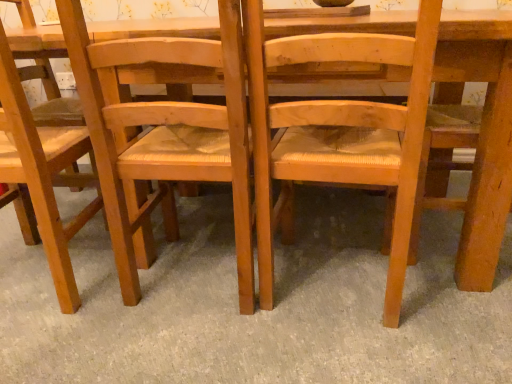
Locate an element on the screen. vacant space in front of natural wood chair at center, the third chair viewed from the left is located at coordinates (355, 352).